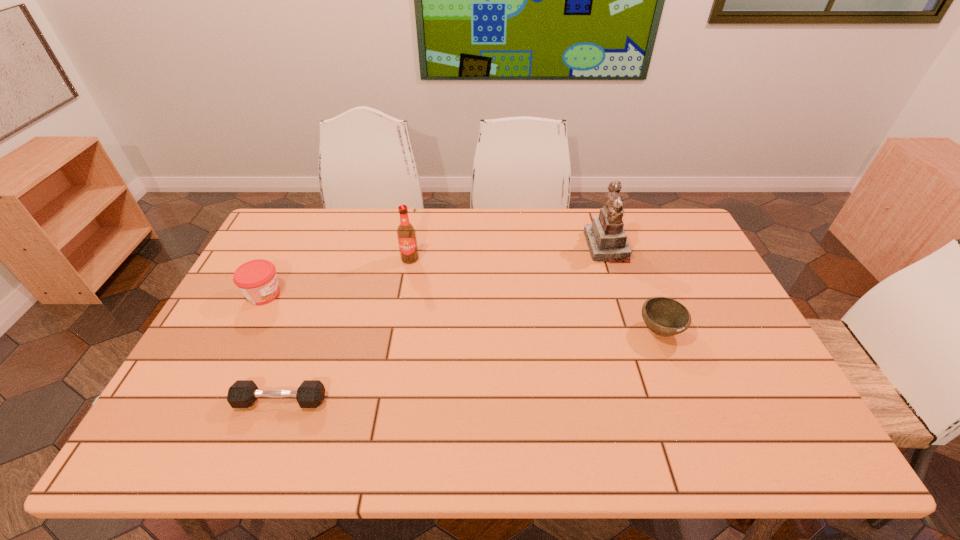
The width and height of the screenshot is (960, 540). I want to click on vacant space that's between the third object from left to right and the third nearest object, so click(337, 276).

Locate an element on the screen. free point between the figurine and the fourth object from right to left is located at coordinates (444, 323).

This screenshot has width=960, height=540. I want to click on vacant area that lies between the nearest object and the third nearest object, so click(273, 348).

At what (x,y) coordinates should I click in order to perform the action: click on free space between the leftmost object and the figurine. Please return your answer as a coordinate pair (x, y). This screenshot has height=540, width=960. Looking at the image, I should click on (435, 271).

At what (x,y) coordinates should I click in order to perform the action: click on empty space that is in between the fourth tallest object and the figurine. Please return your answer as a coordinate pair (x, y). This screenshot has height=540, width=960. Looking at the image, I should click on (633, 288).

Find the location of a particular element. The image size is (960, 540). the closest object relative to the figurine is located at coordinates (664, 316).

Choose which object is the fourth nearest neighbor to the bowl. Please provide its 2D coordinates. Your answer should be formatted as a tuple, i.e. [(x, y)], where the tuple contains the x and y coordinates of a point satisfying the conditions above.

[(257, 280)]

At what (x,y) coordinates should I click in order to perform the action: click on free region that satisfies the following two spatial constraints: 1. on the front-facing side of the second nearest object; 2. on the right side of the figurine. Please return your answer as a coordinate pair (x, y). Looking at the image, I should click on (635, 330).

Identify the location of free space that satisfies the following two spatial constraints: 1. on the label side of the jam; 2. on the back side of the second shortest object. This screenshot has width=960, height=540. (246, 330).

Image resolution: width=960 pixels, height=540 pixels. I want to click on free location that satisfies the following two spatial constraints: 1. on the label side of the second nearest object; 2. on the right side of the third shortest object, so [246, 330].